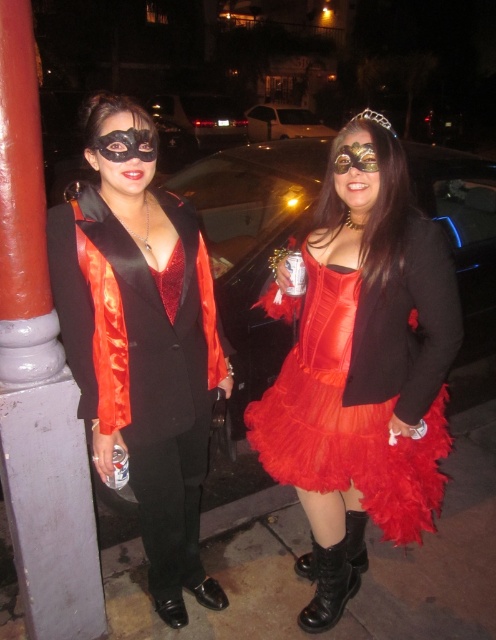
You are a photographer at the event. You want to capture a photo of the two costumes, the satin black vest at left and the shiny satin dress at center. The camera has a minimum focus distance of 18 inches. Can you take a photo of both objects in focus without moving either costume?

The satin black vest at left is 18.49 inches away from the shiny satin dress at center. Since the camera requires a minimum focus distance of 18 inches, the distance between them is sufficient. Therefore, the photographer can take a photo of both the satin black vest at left and the shiny satin dress at center without moving them.